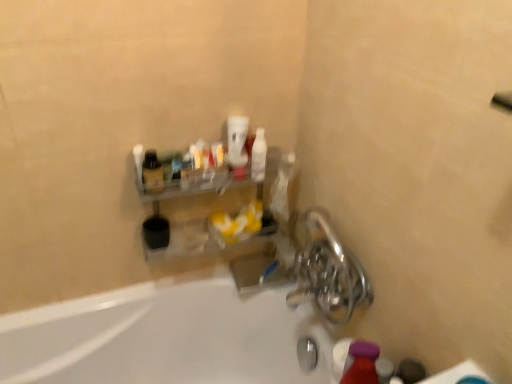
Question: Considering the relative sizes of shiny metallic faucet at lower right and matte black bottle at upper left in the image provided, is shiny metallic faucet at lower right bigger than matte black bottle at upper left?

Choices:
 (A) no
 (B) yes

Answer: (B)

Question: Is shiny metallic faucet at lower right directly adjacent to matte black bottle at upper left?

Choices:
 (A) yes
 (B) no

Answer: (B)

Question: Does shiny metallic faucet at lower right appear on the right side of matte black bottle at upper left?

Choices:
 (A) no
 (B) yes

Answer: (B)

Question: Could you tell me if shiny metallic faucet at lower right is facing matte black bottle at upper left?

Choices:
 (A) no
 (B) yes

Answer: (A)

Question: Is shiny metallic faucet at lower right at the left side of matte black bottle at upper left?

Choices:
 (A) no
 (B) yes

Answer: (A)

Question: Considering the positions of matte purple bottle at lower right and white glossy cup at upper center, which ranks as the 2th mouthwash in right-to-left order, in the image, is matte purple bottle at lower right taller or shorter than white glossy cup at upper center, which ranks as the 2th mouthwash in right-to-left order,?

Choices:
 (A) tall
 (B) short

Answer: (A)

Question: Is matte purple bottle at lower right inside or outside of white glossy cup at upper center, positioned as the 1th mouthwash in left-to-right order?

Choices:
 (A) inside
 (B) outside

Answer: (B)

Question: Is point (349, 382) closer or farther from the camera than point (228, 150)?

Choices:
 (A) farther
 (B) closer

Answer: (B)

Question: From the image's perspective, is matte purple bottle at lower right located above or below white glossy cup at upper center, which ranks as the 2th mouthwash in right-to-left order?

Choices:
 (A) below
 (B) above

Answer: (A)

Question: Is clear plastic shelf at upper center inside or outside of white glossy bottle at upper center, placed as the second mouthwash when sorted from left to right?

Choices:
 (A) outside
 (B) inside

Answer: (A)

Question: From a real-world perspective, is clear plastic shelf at upper center positioned above or below white glossy bottle at upper center, placed as the second mouthwash when sorted from left to right?

Choices:
 (A) above
 (B) below

Answer: (B)

Question: Considering the positions of clear plastic shelf at upper center and white glossy bottle at upper center, the 1th mouthwash positioned from the right, in the image, is clear plastic shelf at upper center wider or thinner than white glossy bottle at upper center, the 1th mouthwash positioned from the right,?

Choices:
 (A) wide
 (B) thin

Answer: (A)

Question: Is point 173,258 positioned closer to the camera than point 257,178?

Choices:
 (A) farther
 (B) closer

Answer: (A)

Question: Is point (243, 153) positioned closer to the camera than point (345, 362)?

Choices:
 (A) closer
 (B) farther

Answer: (B)

Question: From a real-world perspective, relative to matte purple bottle at lower right, is white glossy cup at upper center, which ranks as the 2th mouthwash in right-to-left order, vertically above or below?

Choices:
 (A) below
 (B) above

Answer: (B)